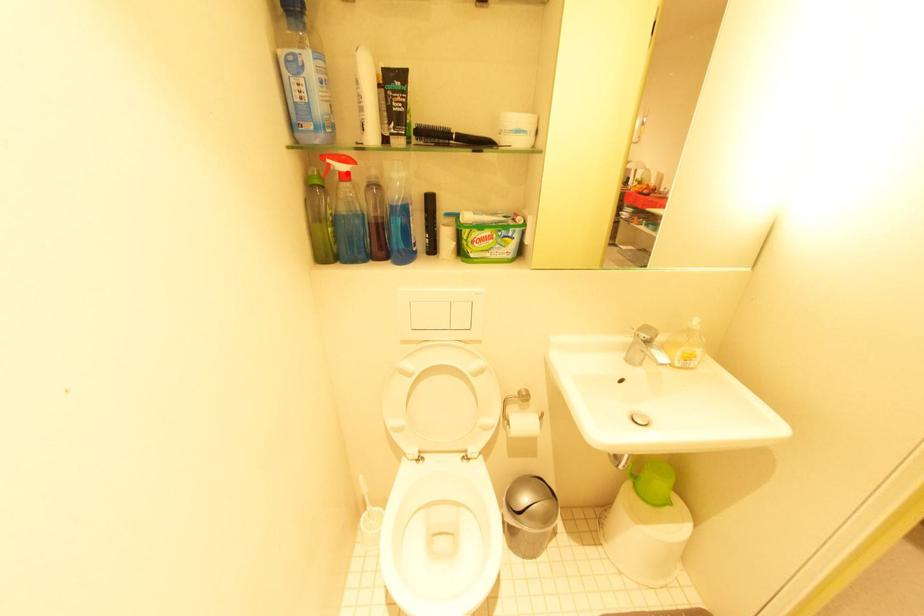
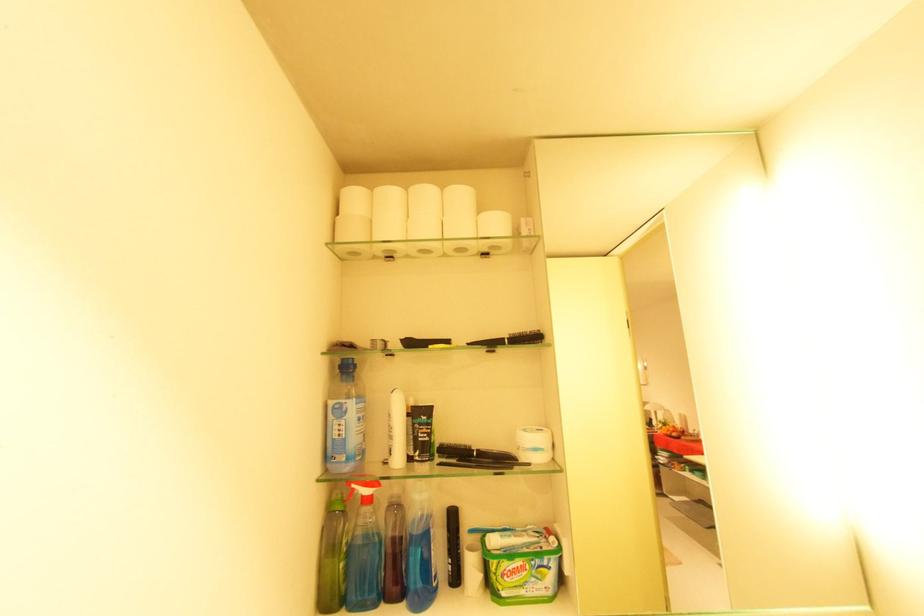
Question: I am providing you with two images of the same scene from different viewpoints. In image1, a red point is highlighted. Considering the same 3D point in image2, which of the following is correct?

Choices:
 (A) It is closer
 (B) It is farther

Answer: (B)